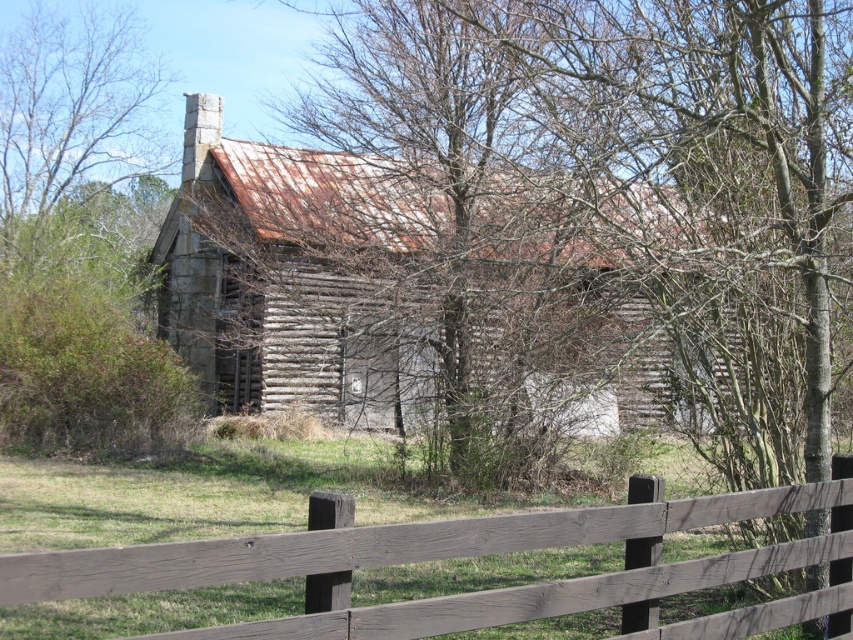
Question: Is rusty wood cabin at center further to camera compared to brown wooden fence at lower center?

Choices:
 (A) yes
 (B) no

Answer: (A)

Question: Is rusty wood cabin at center thinner than brown wooden fence at lower center?

Choices:
 (A) no
 (B) yes

Answer: (A)

Question: Considering the relative positions of rusty wood cabin at center and brown wooden fence at lower center in the image provided, where is rusty wood cabin at center located with respect to brown wooden fence at lower center?

Choices:
 (A) below
 (B) above

Answer: (B)